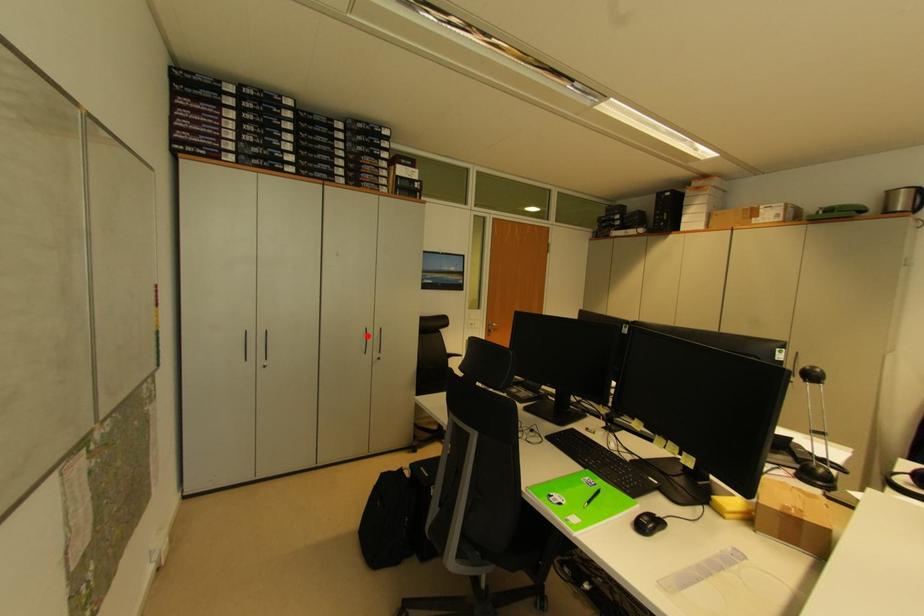
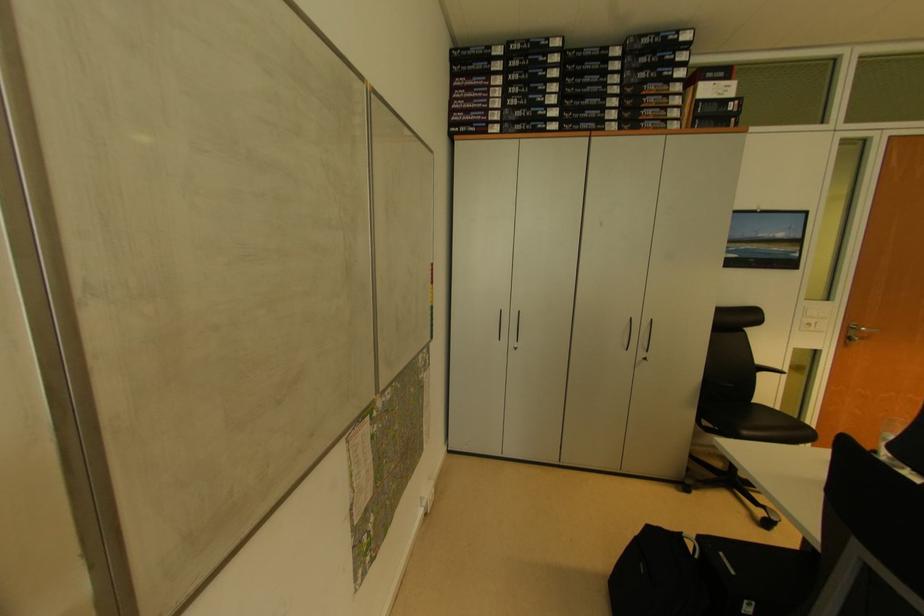
In the second image, find the point that corresponds to the highlighted location in the first image.

(631, 326)